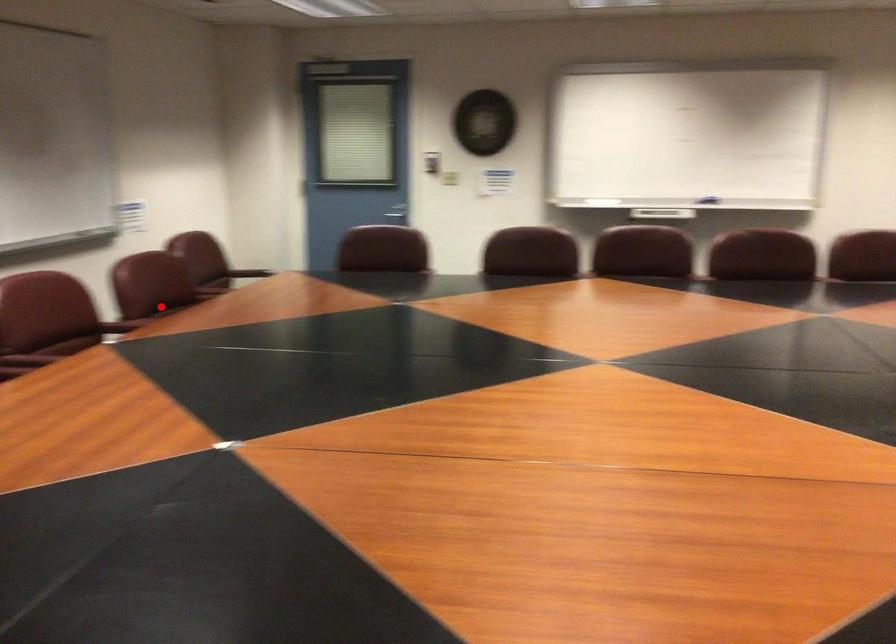
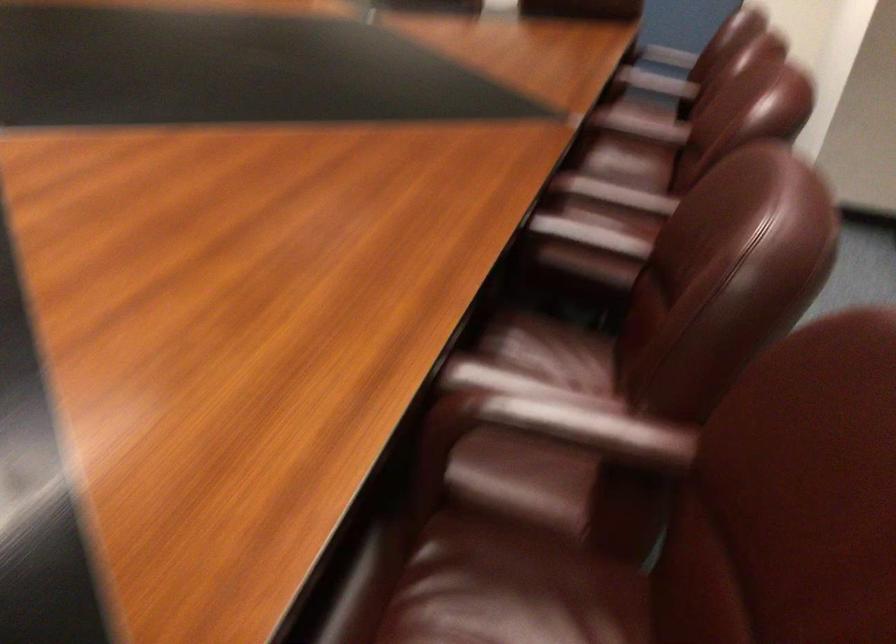
Locate, in the second image, the point that corresponds to the highlighted location in the first image.

(590, 236)